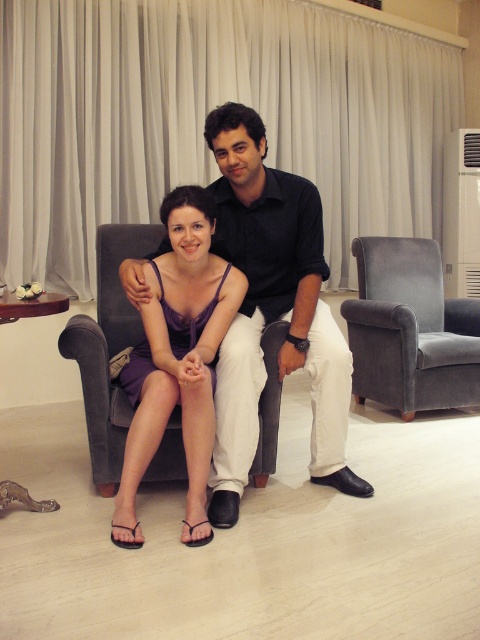
Is black smooth shirt at center in front of velvet gray armchair at right?

That is True.

Who is positioned more to the right, black smooth shirt at center or velvet gray armchair at right?

Positioned to the right is velvet gray armchair at right.

Between point (300, 259) and point (437, 356), which one is positioned in front?

Point (300, 259)

Identify the location of black smooth shirt at center. The height and width of the screenshot is (640, 480). (273, 310).

Can you confirm if black smooth shirt at center is positioned to the right of purple satin dress at center?

Correct, you'll find black smooth shirt at center to the right of purple satin dress at center.

Who is more distant from viewer, (229, 512) or (190, 310)?

The point (190, 310) is more distant.

You are a GUI agent. You are given a task and a screenshot of the screen. Output one action in this format:
    pyautogui.click(x=<x>, y=<y>)
    Task: Click on the black smooth shirt at center
    This screenshot has height=640, width=480.
    Given the screenshot: What is the action you would take?
    point(273,310)

Between purple satin dress at center and velvet gray armchair at right, which one appears on the right side from the viewer's perspective?

velvet gray armchair at right

Is point (135, 464) positioned behind point (373, 305)?

No, (135, 464) is in front of (373, 305).

This screenshot has width=480, height=640. In order to click on purple satin dress at center in this screenshot , I will do `click(178, 358)`.